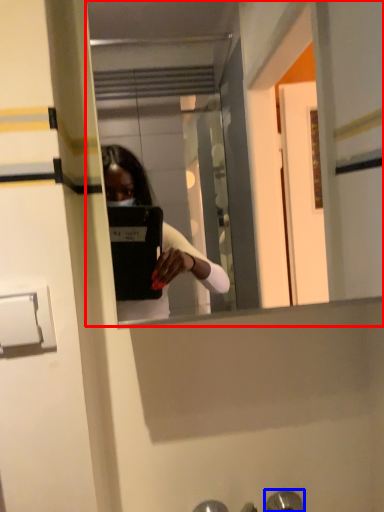
Question: Which of the following is the closest to the observer, mirror (highlighted by a red box) or door handle (highlighted by a blue box)?

Choices:
 (A) mirror
 (B) door handle

Answer: (A)